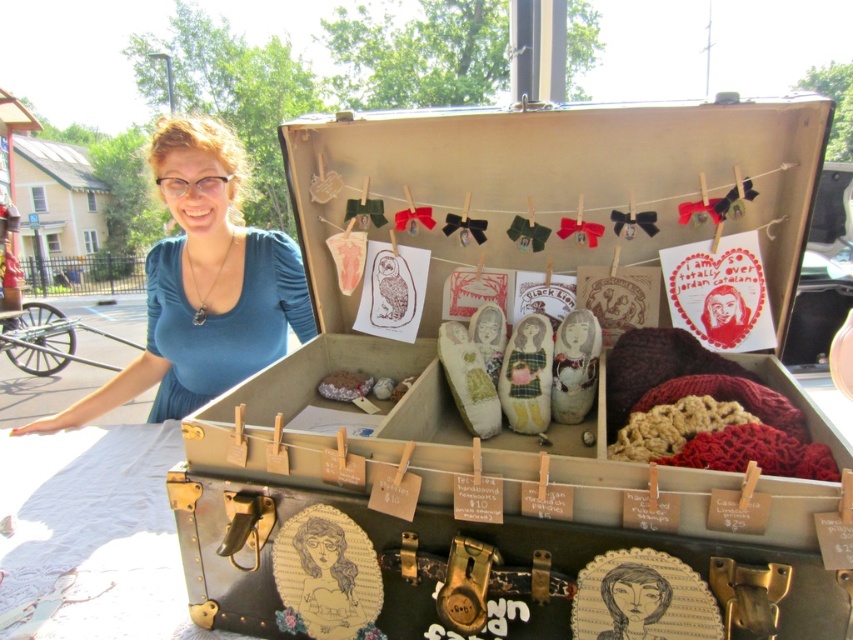
You are an interior designer who wants to place a decorative item on the black paper at center. However, there is a metallic suitcase at center currently above it. Can you place the item there without moving the suitcase?

The metallic suitcase at center is located above the black paper at center, so you cannot place the item there without moving the suitcase.

In the scene shown: You are a delivery person who needs to place a package that is 18 inches long into the space between the metallic suitcase at center and the black paper at center. Can the package fit in that space?

The distance between the metallic suitcase at center and the black paper at center is 18.36 inches. Since the package is 18 inches long, it can fit in the space as there is enough room.